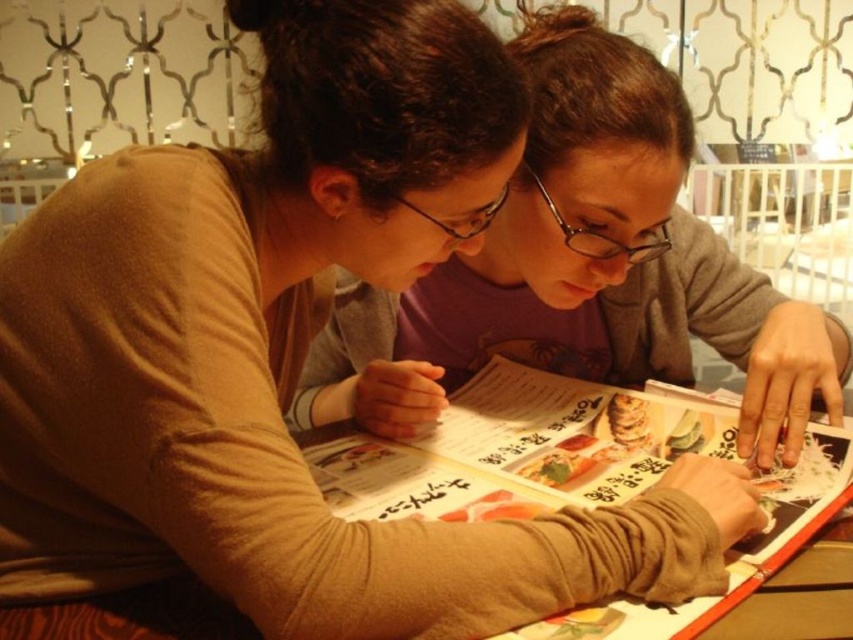
You are a waiter approaching the table where the matte gray sweater at center and the printed paper menu at center are located. Which object should you address first based on their positions?

The matte gray sweater at center is to the left of the printed paper menu at center, so you should address the matte gray sweater at center first as it is closer to your approach from the left side.

You are a server approaching the table to take the order. You notice two customers pointing at different items on the menu. The first customer is pointing at point (601,186), and the second is pointing at point (593,492). Which customer is closer to you as you stand at the front of the table?

The customer pointing at point (593,492) is closer to you because point (601,186) is behind point (593,492) on the menu.